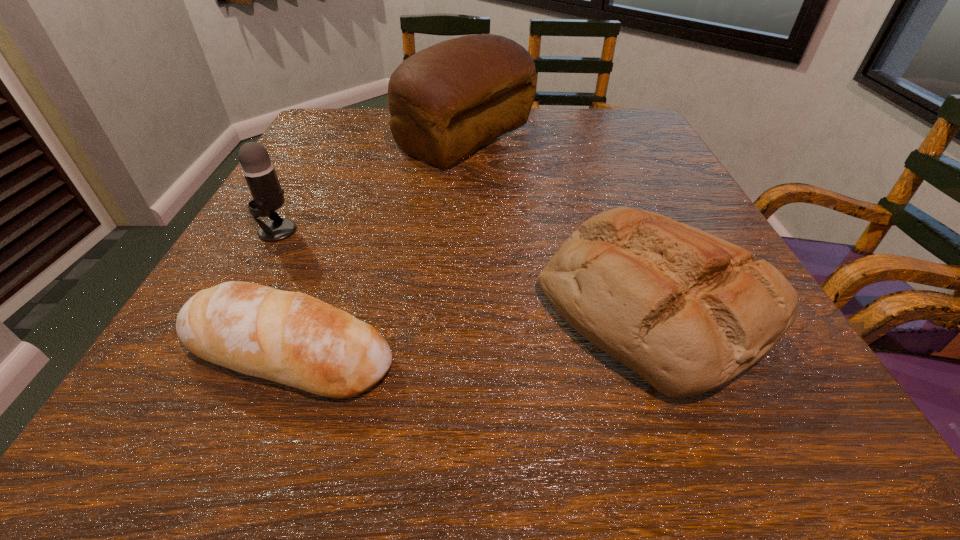
Where is `microphone that is positioned at the left edge`? microphone that is positioned at the left edge is located at coordinates (259, 172).

You are a GUI agent. You are given a task and a screenshot of the screen. Output one action in this format:
    pyautogui.click(x=<x>, y=<y>)
    Task: Click on the bread present at the left edge
    This screenshot has height=540, width=960.
    Given the screenshot: What is the action you would take?
    coord(292,338)

This screenshot has height=540, width=960. I want to click on object positioned at the right edge, so click(x=687, y=311).

You are a GUI agent. You are given a task and a screenshot of the screen. Output one action in this format:
    pyautogui.click(x=<x>, y=<y>)
    Task: Click on the object that is at the near left corner
    This screenshot has width=960, height=540.
    Given the screenshot: What is the action you would take?
    pyautogui.click(x=292, y=338)

I want to click on object at the near right corner, so click(687, 311).

The width and height of the screenshot is (960, 540). Find the location of `vacant area at the far edge`. vacant area at the far edge is located at coordinates (559, 131).

Identify the location of blank area at the near edge. (698, 453).

Where is `blank space at the left edge of the desktop`? The width and height of the screenshot is (960, 540). blank space at the left edge of the desktop is located at coordinates (295, 154).

In the image, there is a desktop. Where is `vacant region at the right edge`? This screenshot has width=960, height=540. vacant region at the right edge is located at coordinates (681, 177).

Identify the location of vacant space at the far left corner of the desktop. The height and width of the screenshot is (540, 960). (360, 129).